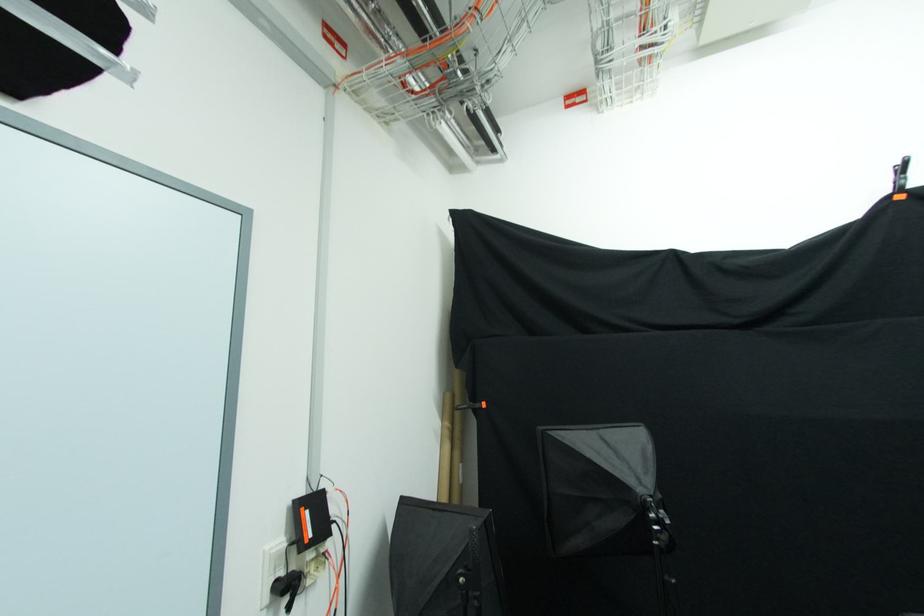
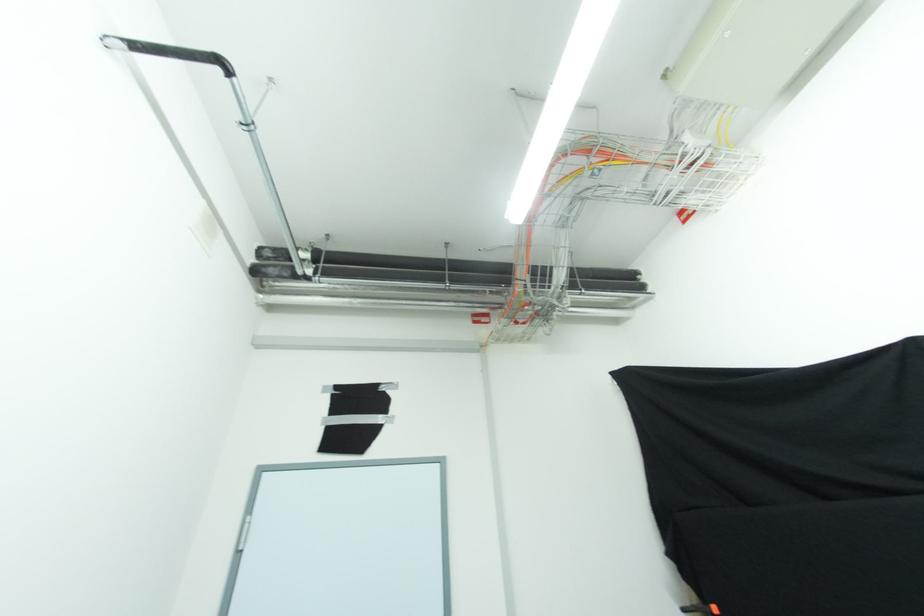
The images are taken continuously from a first-person perspective. In which direction is your viewpoint rotating?

The rotation direction of the camera is left-up.